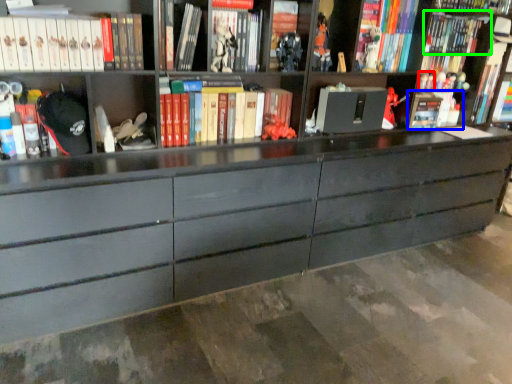
Question: Which object is the closest to the toy (highlighted by a red box)? Choose among these: book (highlighted by a blue box) or book (highlighted by a green box).

Choices:
 (A) book
 (B) book

Answer: (A)